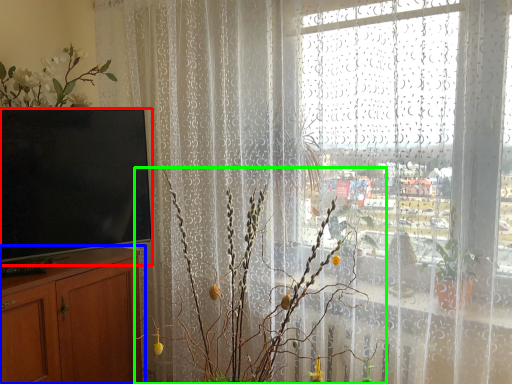
Question: Which is farther away from television (highlighted by a red box)? cabinetry (highlighted by a blue box) or floral arrangement (highlighted by a green box)?

Choices:
 (A) cabinetry
 (B) floral arrangement

Answer: (B)